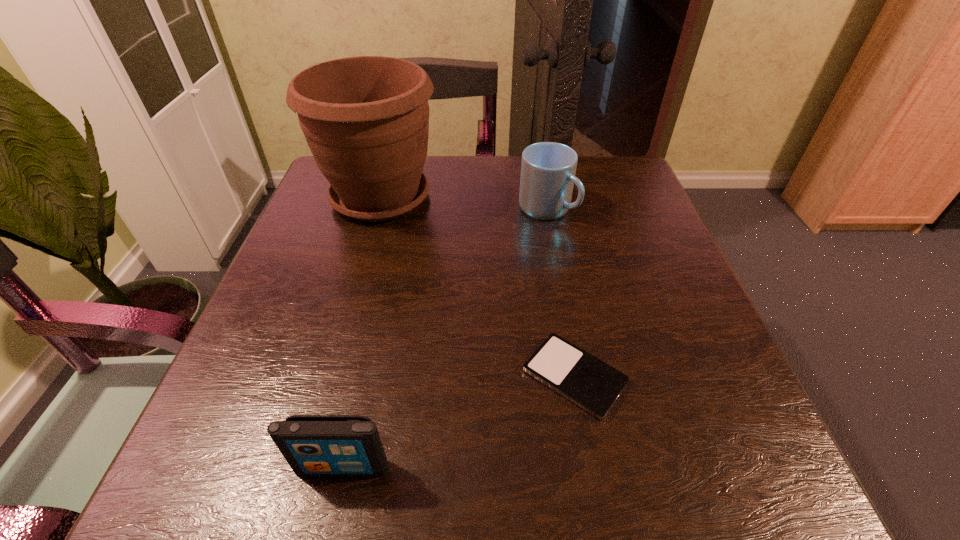
You are a GUI agent. You are given a task and a screenshot of the screen. Output one action in this format:
    pyautogui.click(x=<x>, y=<y>)
    Task: Click on the blank region between the shortest object and the tallest object
    This screenshot has height=540, width=960.
    Given the screenshot: What is the action you would take?
    pyautogui.click(x=477, y=287)

Identify the location of vacant point located between the mug and the flowerpot. The height and width of the screenshot is (540, 960). (464, 203).

At what (x,y) coordinates should I click in order to perform the action: click on free space between the farther iPod and the mug. Please return your answer as a coordinate pair (x, y). The width and height of the screenshot is (960, 540). Looking at the image, I should click on (561, 293).

At what (x,y) coordinates should I click in order to perform the action: click on empty space between the tallest object and the shortest object. Please return your answer as a coordinate pair (x, y). The image size is (960, 540). Looking at the image, I should click on (477, 287).

Find the location of a particular element. This screenshot has height=540, width=960. empty location between the flowerpot and the mug is located at coordinates (464, 203).

Identify the location of empty location between the tallest object and the nearest object. (362, 333).

The height and width of the screenshot is (540, 960). Identify the location of unoccupied area between the taller iPod and the tallest object. (362, 333).

You are a GUI agent. You are given a task and a screenshot of the screen. Output one action in this format:
    pyautogui.click(x=<x>, y=<y>)
    Task: Click on the free space that is in between the flowerpot and the left iPod
    
    Given the screenshot: What is the action you would take?
    pyautogui.click(x=362, y=333)

Identify the location of blank region between the mug and the right iPod. (561, 293).

Identify the location of free area in between the mug and the farther iPod. pyautogui.click(x=561, y=293).